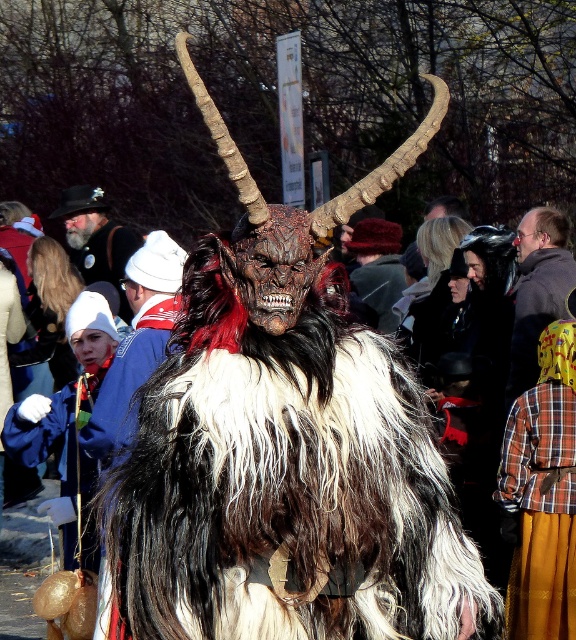
Measure the distance between furry costume at center and camera.

A distance of 7.43 meters exists between furry costume at center and camera.

Is furry costume at center further to camera compared to velvet red hat at center?

No, furry costume at center is in front of velvet red hat at center.

Is point (270, 344) positioned before point (380, 292)?

Yes.

You are a GUI agent. You are given a task and a screenshot of the screen. Output one action in this format:
    pyautogui.click(x=<x>, y=<y>)
    Task: Click on the furry costume at center
    
    Given the screenshot: What is the action you would take?
    pyautogui.click(x=286, y=451)

Does point (555, 221) come farther from viewer compared to point (96, 253)?

No, it is in front of (96, 253).

Which of these two, plaid shirt at right or matte black hat at upper left, stands shorter?

With less height is matte black hat at upper left.

Measure the distance between plaid shirt at right and camera.

plaid shirt at right is 14.31 meters away from camera.

Where is `plaid shirt at right`? This screenshot has height=640, width=576. plaid shirt at right is located at coordinates (537, 291).

Which is above, plaid shirt at right or velvet red hat at center?

Positioned higher is velvet red hat at center.

Is point (563, 292) positioned behind point (382, 275)?

No, (563, 292) is in front of (382, 275).

Is point (543, 289) behind point (393, 300)?

No, (543, 289) is in front of (393, 300).

In order to click on plaid shirt at right in this screenshot , I will do `click(537, 291)`.